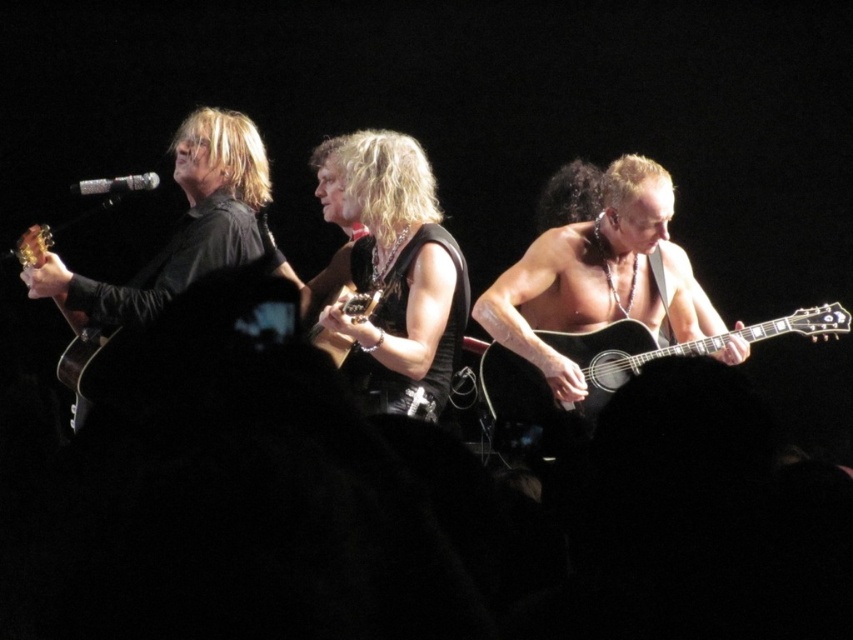
Who is shorter, acoustic wood guitar at right or matte black guitar at left?

acoustic wood guitar at right is shorter.

Does acoustic wood guitar at right have a lesser height compared to matte black guitar at left?

Yes.

Between point (654, 358) and point (83, 358), which one is positioned in front?

Point (83, 358) is more forward.

Identify the location of acoustic wood guitar at right. Image resolution: width=853 pixels, height=640 pixels. (602, 374).

Is acoustic wood guitar at right positioned behind silver metallic microphone at upper center?

Yes, acoustic wood guitar at right is further from the viewer.

This screenshot has height=640, width=853. Identify the location of acoustic wood guitar at right. 602,374.

Which of these two, black leather vest at center or matte black guitar at center, stands taller?

black leather vest at center

Is point (378, 188) positioned in front of point (335, 346)?

No.

I want to click on black leather vest at center, so click(x=396, y=280).